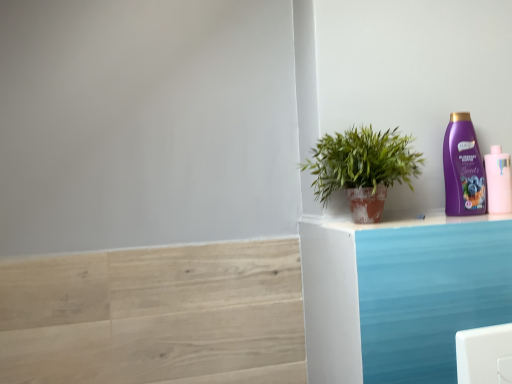
Question: From a real-world perspective, is purple glossy shampoo bottle at upper right, marked as the second bottle in a right-to-left arrangement, positioned over light wood stair at lower left based on gravity?

Choices:
 (A) yes
 (B) no

Answer: (A)

Question: Is purple glossy shampoo bottle at upper right, marked as the second bottle in a right-to-left arrangement, positioned in front of light wood stair at lower left?

Choices:
 (A) yes
 (B) no

Answer: (B)

Question: From a real-world perspective, is purple glossy shampoo bottle at upper right, marked as the second bottle in a right-to-left arrangement, positioned under light wood stair at lower left based on gravity?

Choices:
 (A) no
 (B) yes

Answer: (A)

Question: Is purple glossy shampoo bottle at upper right, marked as the second bottle in a right-to-left arrangement, positioned behind light wood stair at lower left?

Choices:
 (A) yes
 (B) no

Answer: (A)

Question: Is light wood stair at lower left completely or partially inside purple glossy shampoo bottle at upper right, marked as the second bottle in a right-to-left arrangement?

Choices:
 (A) yes
 (B) no

Answer: (B)

Question: Is pink matte bottle at upper right, the first bottle viewed from the right, wider or thinner than light wood stair at lower left?

Choices:
 (A) thin
 (B) wide

Answer: (B)

Question: Is pink matte bottle at upper right, the first bottle viewed from the right, situated inside light wood stair at lower left or outside?

Choices:
 (A) inside
 (B) outside

Answer: (B)

Question: From the image's perspective, is pink matte bottle at upper right, the second bottle from the left, located above or below light wood stair at lower left?

Choices:
 (A) below
 (B) above

Answer: (B)

Question: Is pink matte bottle at upper right, the first bottle viewed from the right, bigger or smaller than light wood stair at lower left?

Choices:
 (A) small
 (B) big

Answer: (A)

Question: Is point click(349, 203) positioned closer to the camera than point click(118, 283)?

Choices:
 (A) closer
 (B) farther

Answer: (A)

Question: Based on their sizes in the image, would you say green leafy plant in terracotta pot at right is bigger or smaller than light wood stair at lower left?

Choices:
 (A) small
 (B) big

Answer: (B)

Question: Is green leafy plant in terracotta pot at right spatially inside light wood stair at lower left, or outside of it?

Choices:
 (A) outside
 (B) inside

Answer: (A)

Question: Would you say green leafy plant in terracotta pot at right is to the left or to the right of light wood stair at lower left in the picture?

Choices:
 (A) left
 (B) right

Answer: (B)

Question: Is point (497, 192) closer or farther from the camera than point (352, 185)?

Choices:
 (A) closer
 (B) farther

Answer: (B)

Question: Looking at their shapes, would you say pink matte bottle at upper right, the second bottle from the left, is wider or thinner than green leafy plant in terracotta pot at right?

Choices:
 (A) thin
 (B) wide

Answer: (A)